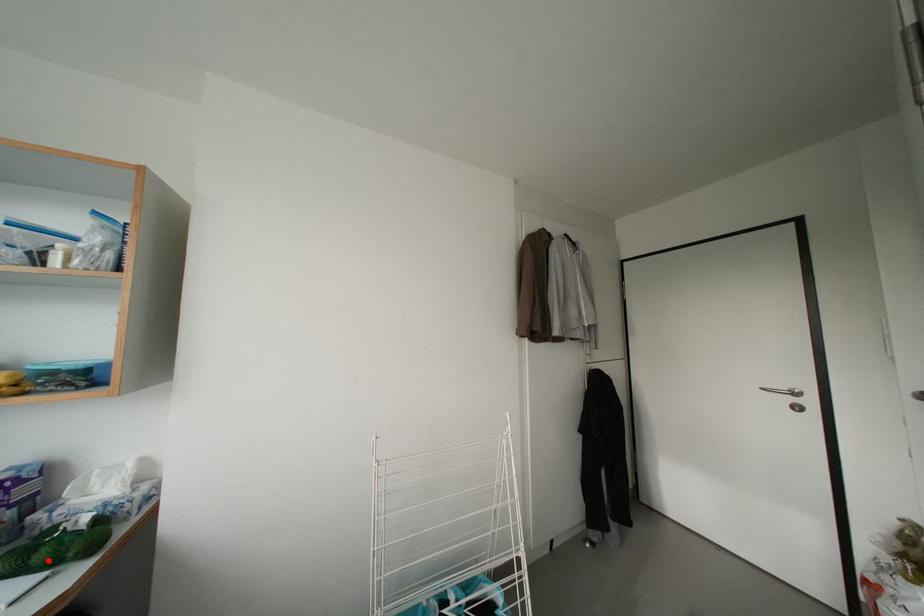
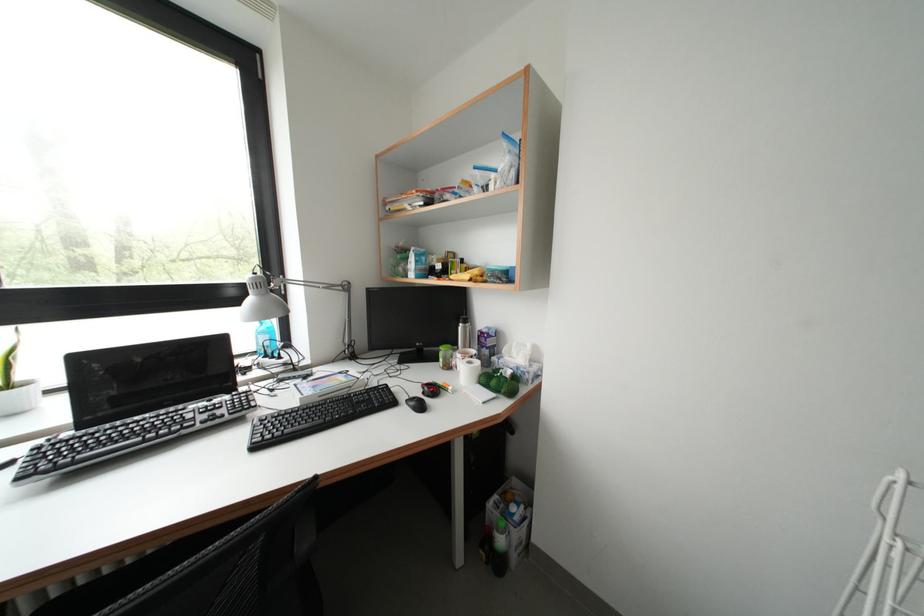
The point at the highlighted location is marked in the first image. Where is the corresponding point in the second image?

(500, 387)